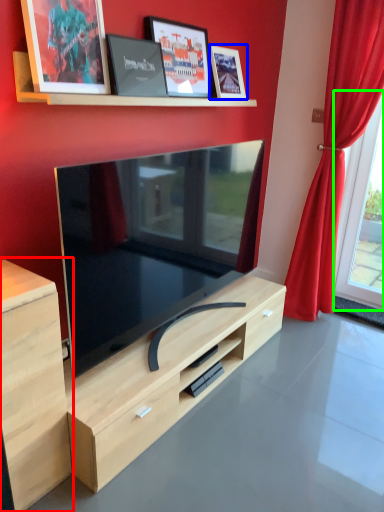
Question: Which object is the closest to the cabinetry (highlighted by a red box)? Choose among these: picture frame (highlighted by a blue box) or window (highlighted by a green box).

Choices:
 (A) picture frame
 (B) window

Answer: (A)